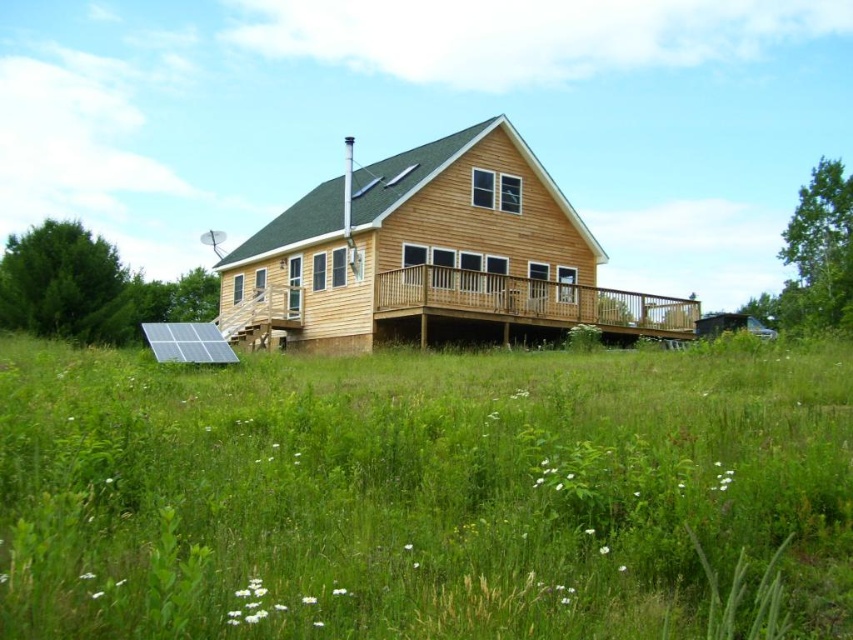
You are standing at the entrance of the rustic wooden house and want to place a new flower pot. The flower pot needs to be placed on the green grass at center. According to the image, where exactly should you place the flower pot?

The green grass at center is located at point (419, 492), so you should place the flower pot there.

You are planning to install a new garden bed in the area between the green grass at center and the wooden deck at center. Given the space available, which area has more room for expansion?

The green grass at center has a larger width than the wooden deck at center, so it has more room for expansion.

You are planning to install a garden path from the green grass at center to the wooden deck at center. The path requires a minimum of 10 meters of material. Do you have enough material?

The distance between the green grass at center and the wooden deck at center is 10.72 meters, so you have enough material since it exceeds the required 10 meters.